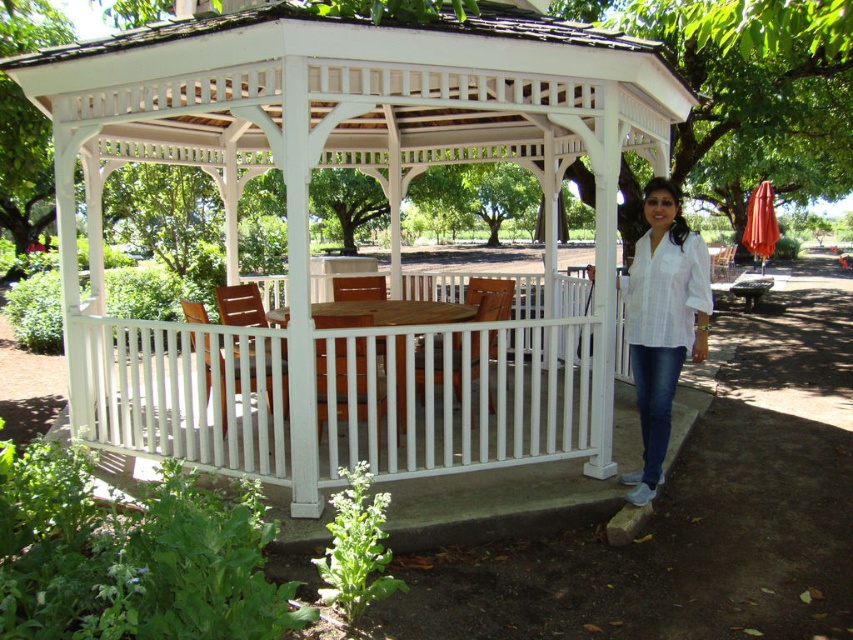
Between white painted wood porch at center and wooden picnic table at center, which one is positioned higher?

Positioned higher is wooden picnic table at center.

Is point (338, 312) positioned behind point (372, 308)?

No, (338, 312) is closer to viewer.

You are a GUI agent. You are given a task and a screenshot of the screen. Output one action in this format:
    pyautogui.click(x=<x>, y=<y>)
    Task: Click on the white painted wood porch at center
    
    Given the screenshot: What is the action you would take?
    pyautogui.click(x=354, y=388)

Based on the photo, is white painted wood porch at center shorter than white cotton shirt at lower right?

Yes, white painted wood porch at center is shorter than white cotton shirt at lower right.

I want to click on white painted wood porch at center, so click(x=354, y=388).

This screenshot has height=640, width=853. I want to click on white painted wood porch at center, so click(354, 388).

Who is higher up, white wood gazebo at center or wooden picnic table at center?

Positioned higher is wooden picnic table at center.

Is point (32, 67) less distant than point (457, 304)?

Yes, point (32, 67) is in front of point (457, 304).

Between point (502, 29) and point (271, 316), which one is positioned in front?

Point (502, 29) is more forward.

Image resolution: width=853 pixels, height=640 pixels. Identify the location of white wood gazebo at center. (306, 225).